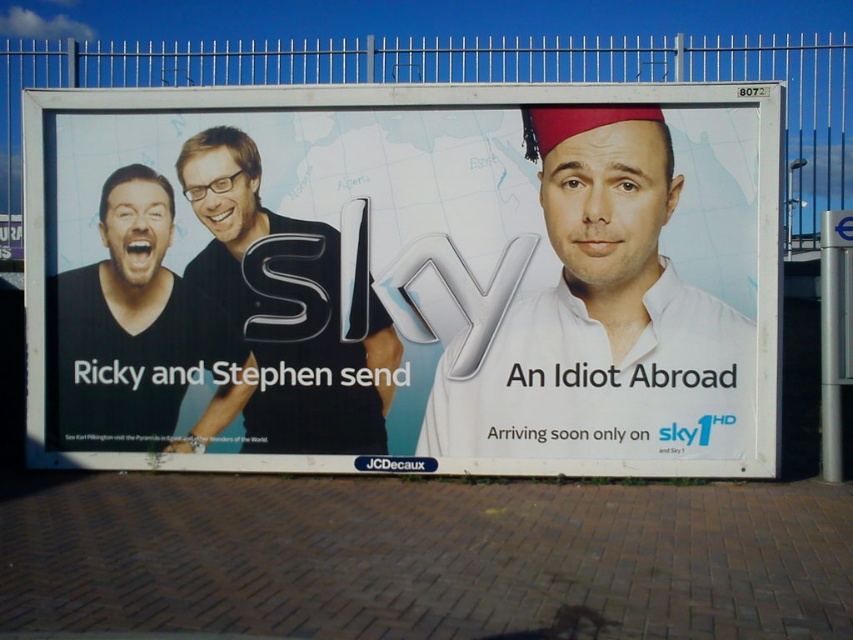
The image size is (853, 640). What do you see at coordinates (404, 278) in the screenshot? I see `white paper billboard at center` at bounding box center [404, 278].

Is point (405, 465) closer to viewer compared to point (718, 419)?

No.

Is point (529, 250) closer to camera compared to point (537, 147)?

No.

The height and width of the screenshot is (640, 853). Identify the location of white paper billboard at center. (404, 278).

Measure the distance between white matte headwear at center and camera.

They are 26.40 feet apart.

Is white matte headwear at center to the right of matte black shirt at left from the viewer's perspective?

Correct, you'll find white matte headwear at center to the right of matte black shirt at left.

You are a GUI agent. You are given a task and a screenshot of the screen. Output one action in this format:
    pyautogui.click(x=<x>, y=<y>)
    Task: Click on the white matte headwear at center
    The width and height of the screenshot is (853, 640).
    Given the screenshot: What is the action you would take?
    pyautogui.click(x=602, y=317)

Identify the location of white matte headwear at center. [x=602, y=317].

Can you confirm if white paper billboard at center is smaller than black glossy shirt at center?

Actually, white paper billboard at center might be larger than black glossy shirt at center.

Who is shorter, white paper billboard at center or black glossy shirt at center?

black glossy shirt at center

Does point (262, 236) lie behind point (256, 403)?

No, it is not.

Locate an element on the screen. This screenshot has width=853, height=640. white paper billboard at center is located at coordinates (404, 278).